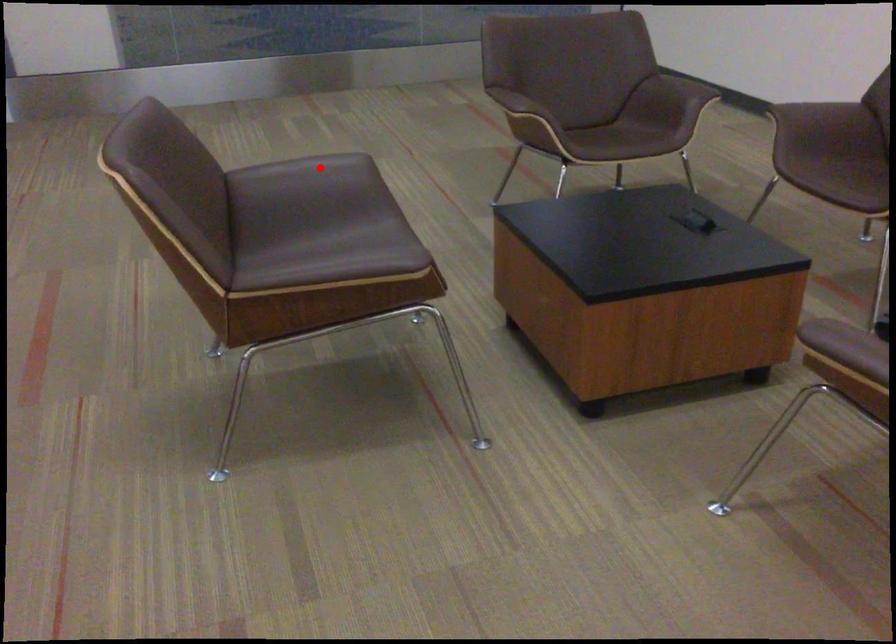
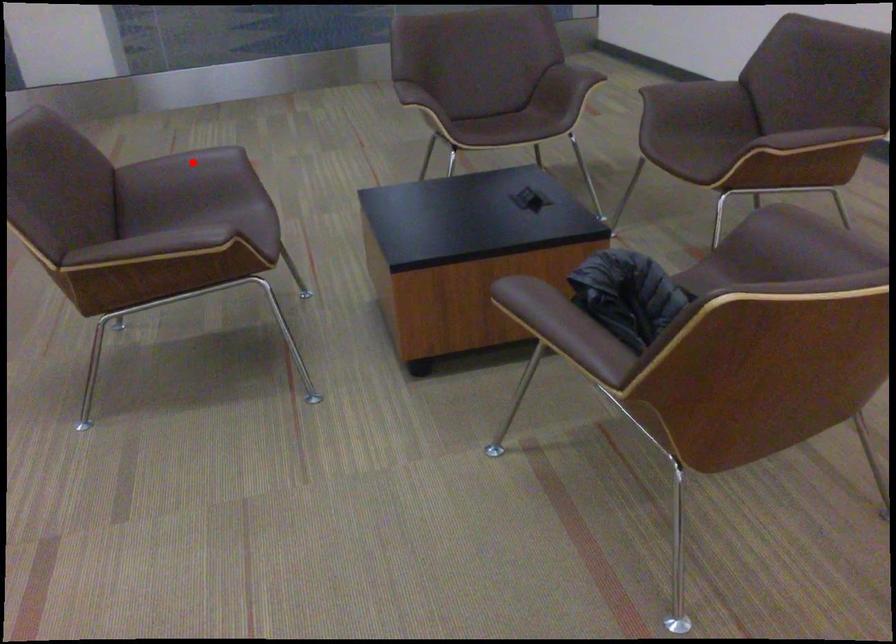
Looking at this image, I am providing you with two images of the same scene from different viewpoints. A red point is marked on the first image and another point is marked on the second image. Is the red point in image1 aligned with the point shown in image2?

Yes